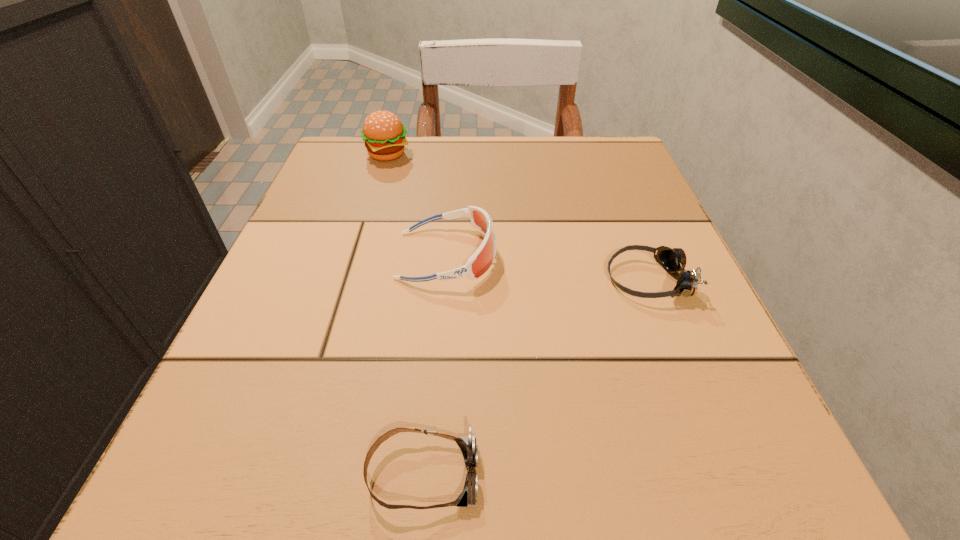
Find the location of a particular element. the tallest object is located at coordinates tap(384, 135).

Where is `the farthest object`? The image size is (960, 540). the farthest object is located at coordinates (384, 135).

I want to click on the tallest goggles, so click(x=482, y=259).

You are a GUI agent. You are given a task and a screenshot of the screen. Output one action in this format:
    pyautogui.click(x=<x>, y=<y>)
    Task: Click on the rightmost goggles
    This screenshot has height=540, width=960.
    Given the screenshot: What is the action you would take?
    pyautogui.click(x=672, y=260)

This screenshot has height=540, width=960. Identify the location of the rightmost object. (672, 260).

Identify the location of the nearest goggles. This screenshot has width=960, height=540. (467, 445).

What are the coordinates of `the nearest object` in the screenshot? It's located at (467, 445).

Identify the location of vacant space situated on the front of the tallest object. (357, 256).

At what (x,y) coordinates should I click in order to perform the action: click on vacant space situated 0.190m on the front-facing side of the second tallest object. Please return your answer as a coordinate pair (x, y). The height and width of the screenshot is (540, 960). Looking at the image, I should click on (611, 255).

Locate an element on the screen. Image resolution: width=960 pixels, height=540 pixels. blank space located 0.210m through the lenses of the third tallest object is located at coordinates (473, 280).